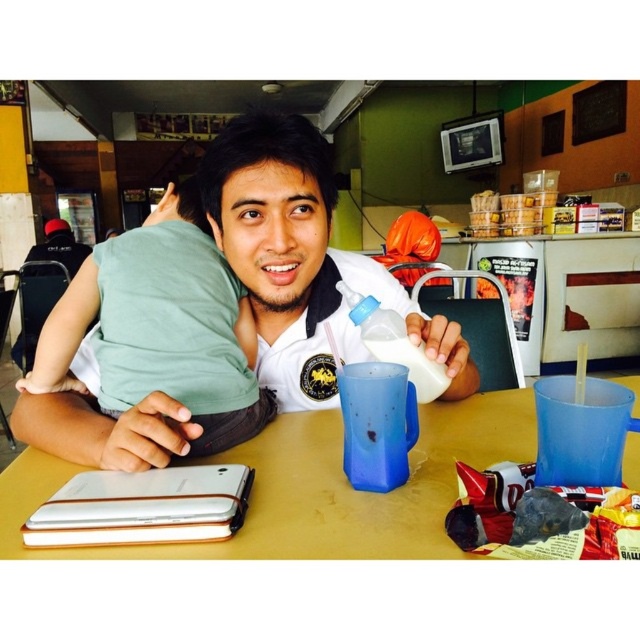
Question: Which of the following is the farthest from the observer?

Choices:
 (A) (212, 324)
 (B) (400, 326)

Answer: (A)

Question: Which object is farther from the camera taking this photo?

Choices:
 (A) green cotton shirt at left
 (B) yellow matte table at center
 (C) white matte shirt at center
 (D) white plastic bottle at center

Answer: (D)

Question: Is white matte shirt at center further to the viewer compared to green cotton shirt at left?

Choices:
 (A) no
 (B) yes

Answer: (B)

Question: Is the position of white matte shirt at center more distant than that of white plastic bottle at center?

Choices:
 (A) no
 (B) yes

Answer: (A)

Question: Estimate the real-world distances between objects in this image. Which object is farther from the yellow matte table at center?

Choices:
 (A) white plastic bottle at center
 (B) white matte shirt at center
 (C) green cotton shirt at left

Answer: (A)

Question: Does yellow matte table at center appear on the right side of green cotton shirt at left?

Choices:
 (A) yes
 (B) no

Answer: (A)